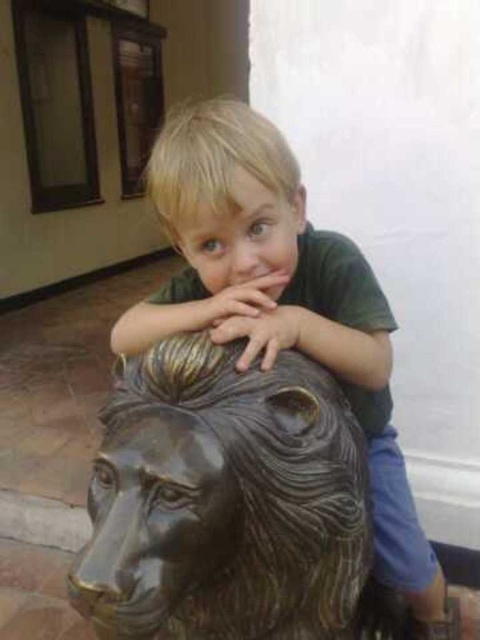
Question: Does bronze textured lion head at center have a greater width compared to matte green shirt at center?

Choices:
 (A) yes
 (B) no

Answer: (B)

Question: Among these objects, which one is nearest to the camera?

Choices:
 (A) bronze textured lion head at center
 (B) matte green shirt at center

Answer: (A)

Question: Is bronze textured lion head at center below matte green shirt at center?

Choices:
 (A) no
 (B) yes

Answer: (A)

Question: Which object is closer to the camera taking this photo?

Choices:
 (A) bronze textured lion head at center
 (B) matte green shirt at center

Answer: (A)

Question: Is bronze textured lion head at center bigger than matte green shirt at center?

Choices:
 (A) yes
 (B) no

Answer: (B)